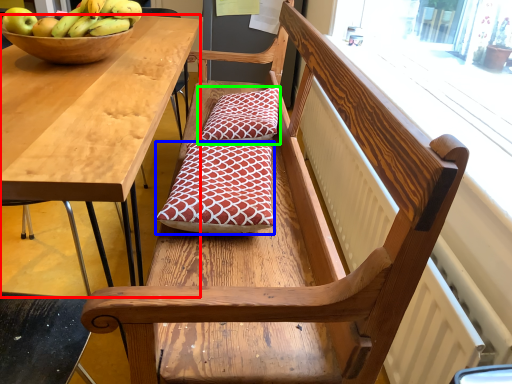
Question: Which object is positioned closest to desk (highlighted by a red box)? Select from pillow (highlighted by a blue box) and pillow (highlighted by a green box).

Choices:
 (A) pillow
 (B) pillow

Answer: (A)